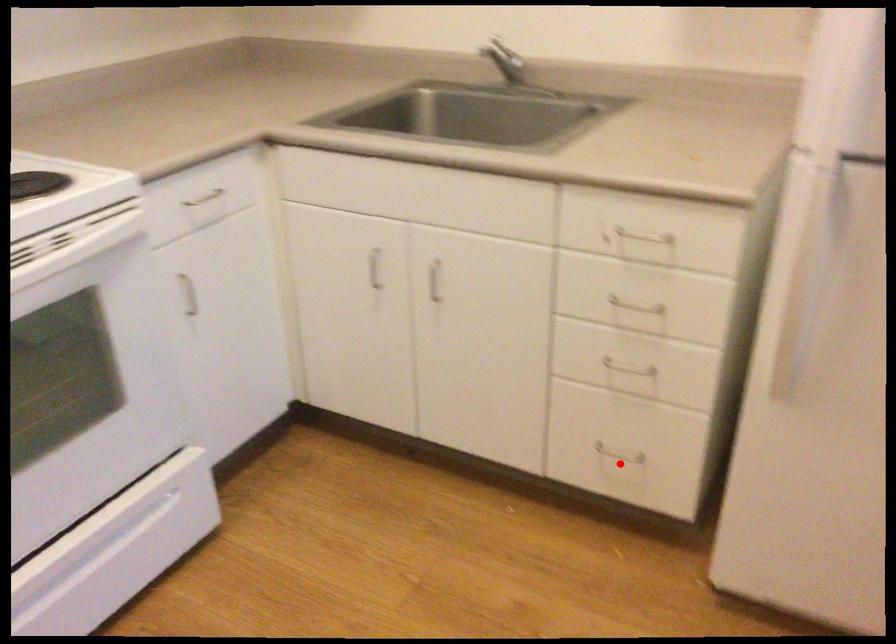
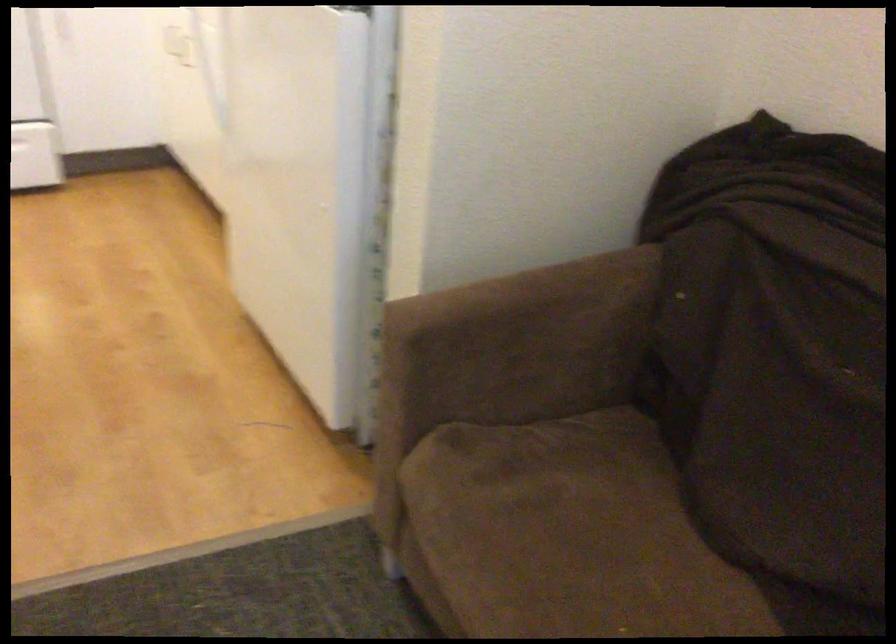
Question: I am providing you with two images of the same scene from different viewpoints. A red point is marked on the first image. Can you still see the location of the red point in image 2?

Choices:
 (A) Yes
 (B) No

Answer: (B)